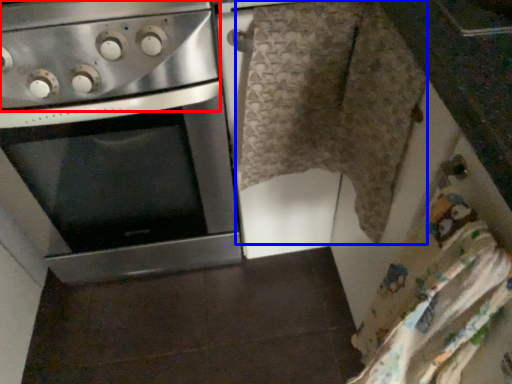
Question: Which object is further to the camera taking this photo, gas stove (highlighted by a red box) or blanket (highlighted by a blue box)?

Choices:
 (A) gas stove
 (B) blanket

Answer: (B)